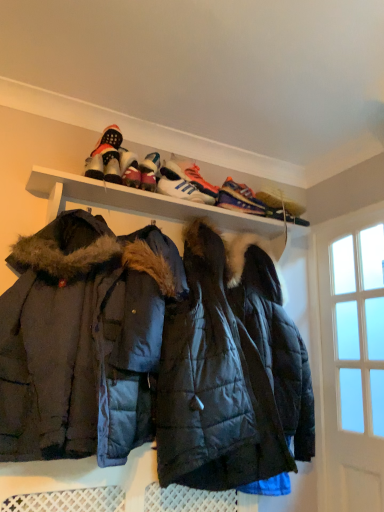
Question: Is white matte shelf at upper center looking in the opposite direction of white leather sneaker at upper center, the 5th footwear viewed from the right?

Choices:
 (A) no
 (B) yes

Answer: (A)

Question: Considering the relative sizes of white matte shelf at upper center and white leather sneaker at upper center, which is the 1th footwear from left to right, in the image provided, is white matte shelf at upper center smaller than white leather sneaker at upper center, which is the 1th footwear from left to right,?

Choices:
 (A) yes
 (B) no

Answer: (B)

Question: Does white matte shelf at upper center have a lesser height compared to white leather sneaker at upper center, which is the 1th footwear from left to right?

Choices:
 (A) no
 (B) yes

Answer: (A)

Question: Is white matte shelf at upper center next to white leather sneaker at upper center, which is the 1th footwear from left to right, and touching it?

Choices:
 (A) yes
 (B) no

Answer: (B)

Question: Does white matte shelf at upper center have a lesser width compared to white leather sneaker at upper center, the 5th footwear viewed from the right?

Choices:
 (A) yes
 (B) no

Answer: (B)

Question: Is white matte shelf at upper center located outside white leather sneaker at upper center, the 5th footwear viewed from the right?

Choices:
 (A) no
 (B) yes

Answer: (B)

Question: Considering the relative sizes of dark blue quilted jacket at center and clear glass door at right in the image provided, is dark blue quilted jacket at center bigger than clear glass door at right?

Choices:
 (A) no
 (B) yes

Answer: (B)

Question: From the image's perspective, is dark blue quilted jacket at center over clear glass door at right?

Choices:
 (A) no
 (B) yes

Answer: (B)

Question: From a real-world perspective, is dark blue quilted jacket at center physically above clear glass door at right?

Choices:
 (A) yes
 (B) no

Answer: (A)

Question: Considering the relative sizes of dark blue quilted jacket at center and clear glass door at right in the image provided, is dark blue quilted jacket at center wider than clear glass door at right?

Choices:
 (A) no
 (B) yes

Answer: (B)

Question: Is dark blue quilted jacket at center placed right next to clear glass door at right?

Choices:
 (A) no
 (B) yes

Answer: (A)

Question: Is dark blue quilted jacket at center oriented towards clear glass door at right?

Choices:
 (A) no
 (B) yes

Answer: (A)

Question: Is white leather sneakers at upper center, the 3th footwear when ordered from left to right, at the right side of shiny black sneakers at upper center, the fifth footwear when ordered from left to right?

Choices:
 (A) no
 (B) yes

Answer: (A)